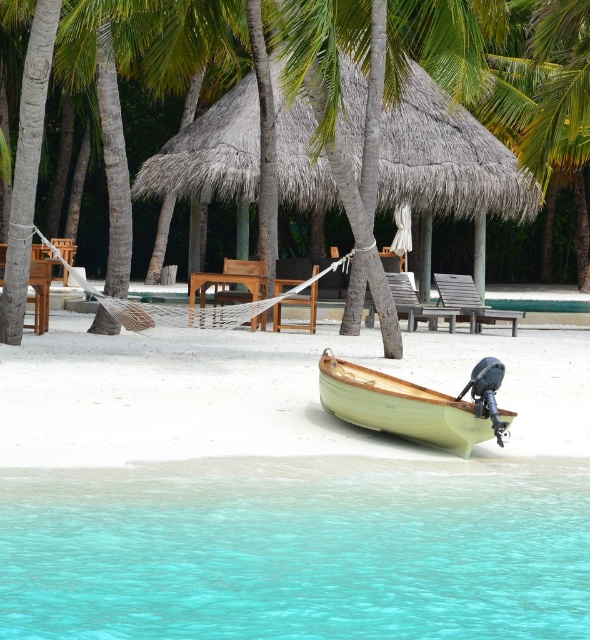
Question: From the image, what is the correct spatial relationship of light wood boat at center in relation to wooden textured beach chair at center?

Choices:
 (A) right
 (B) left

Answer: (B)

Question: Which object is closer to the camera taking this photo?

Choices:
 (A) thatched roof hut at center
 (B) turquoise clear water at lower center
 (C) wooden textured beach chair at center

Answer: (B)

Question: Which point is closer to the camera?

Choices:
 (A) light wood boat at center
 (B) light wood motorboat at lower center

Answer: (A)

Question: Can you confirm if thatched roof hut at center is positioned below wooden textured beach chair at center?

Choices:
 (A) yes
 (B) no

Answer: (B)

Question: Can you confirm if light wood boat at center is smaller than wooden textured beach chair at center?

Choices:
 (A) yes
 (B) no

Answer: (B)

Question: Which is farther from the light wood motorboat at lower center?

Choices:
 (A) light wood boat at center
 (B) wooden textured beach chair at center
 (C) turquoise clear water at lower center
 (D) thatched roof hut at center

Answer: (B)